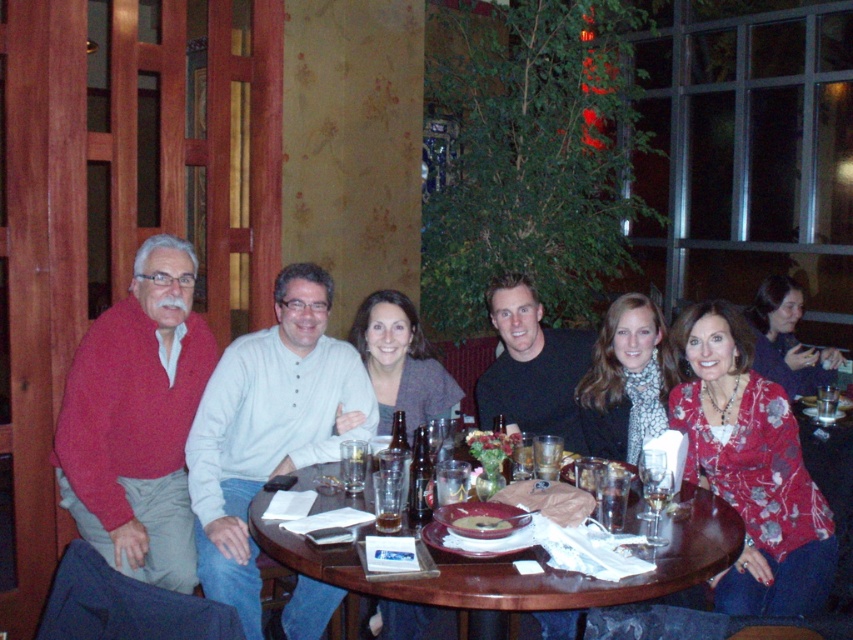
Between point (498, 522) and point (393, 518), which one is positioned behind?

The point (393, 518) is behind.

Who is more forward, (488, 515) or (381, 522)?

Point (381, 522) is more forward.

Is point (508, 520) closer to viewer compared to point (393, 525)?

No, it is not.

At what (x,y) coordinates should I click in order to perform the action: click on smooth brown bread at center. Please return your answer as a coordinate pair (x, y). The width and height of the screenshot is (853, 640). Looking at the image, I should click on (482, 524).

The width and height of the screenshot is (853, 640). Describe the element at coordinates (137, 420) in the screenshot. I see `knitted red sweater at left` at that location.

Does knitted red sweater at left come in front of brown wooden table at center?

No, it is not.

Between point (167, 468) and point (497, 608), which one is positioned behind?

The point (167, 468) is more distant.

Locate an element on the screen. This screenshot has height=640, width=853. knitted red sweater at left is located at coordinates (137, 420).

Does dark blue sweater at right have a greater width compared to smooth brown bread at center?

Yes.

Between dark blue sweater at right and smooth brown bread at center, which one appears on the left side from the viewer's perspective?

From the viewer's perspective, smooth brown bread at center appears more on the left side.

Between point (790, 323) and point (508, 522), which one is positioned behind?

The point (790, 323) is more distant.

I want to click on dark blue sweater at right, so click(786, 339).